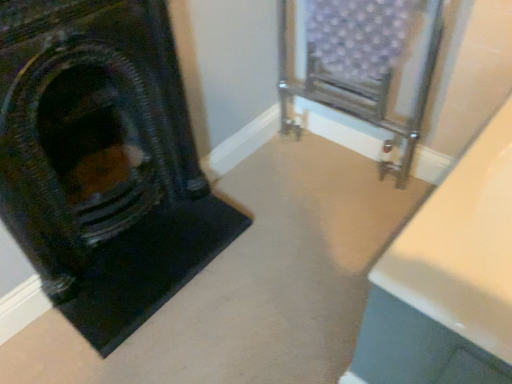
Where is `vacant space in matte black fireplace at left (from a real-world perspective)`? The image size is (512, 384). vacant space in matte black fireplace at left (from a real-world perspective) is located at coordinates (133, 238).